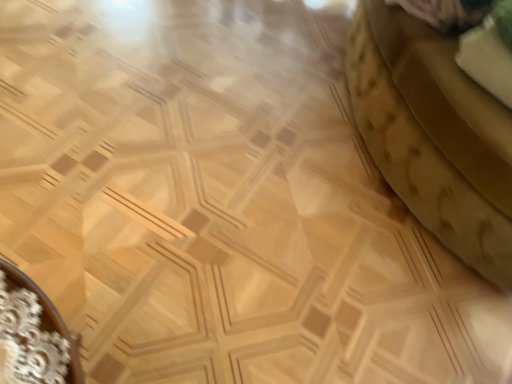
Describe the element at coordinates (432, 134) in the screenshot. I see `velvet green ottoman at right` at that location.

This screenshot has height=384, width=512. In order to click on velvet green ottoman at right in this screenshot , I will do `click(432, 134)`.

Find the location of a particular element. The image size is (512, 384). velvet green ottoman at right is located at coordinates (432, 134).